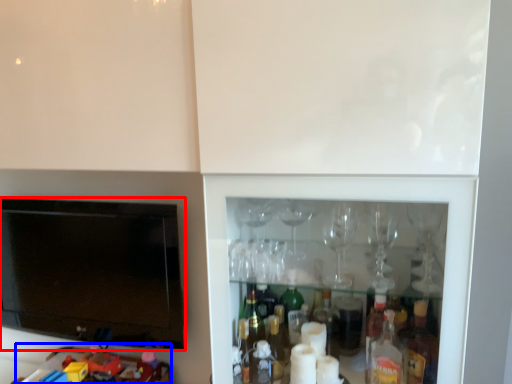
Question: Which point is further to the camera, television (highlighted by a red box) or toy (highlighted by a blue box)?

Choices:
 (A) television
 (B) toy

Answer: (A)